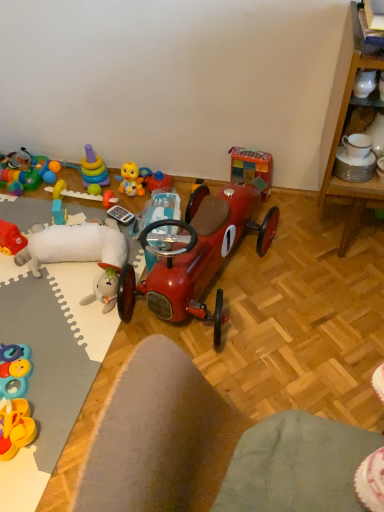
Locate an element on the screen. Image resolution: width=384 pixels, height=512 pixels. vacant space to the right of shiny red car at center, the second toy from the right is located at coordinates click(311, 285).